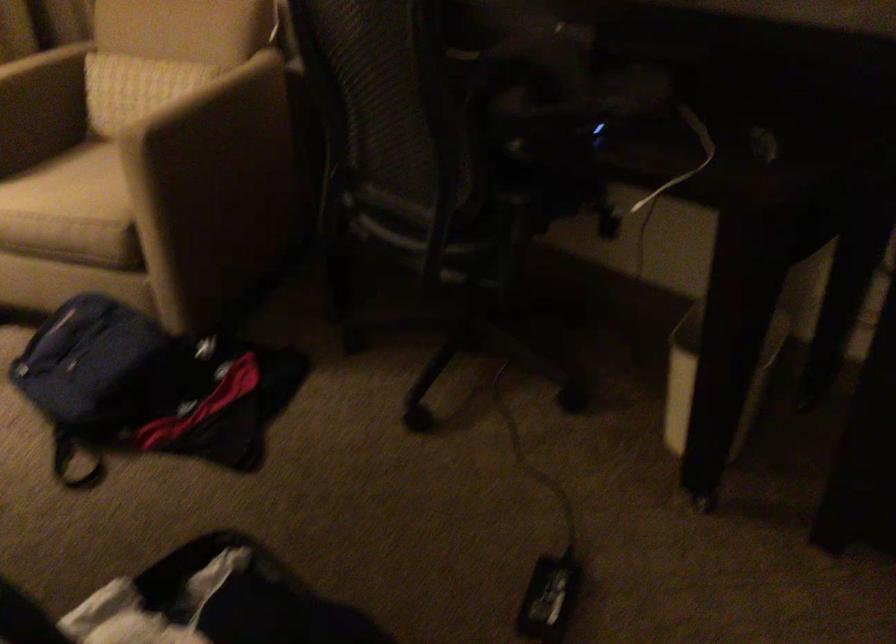
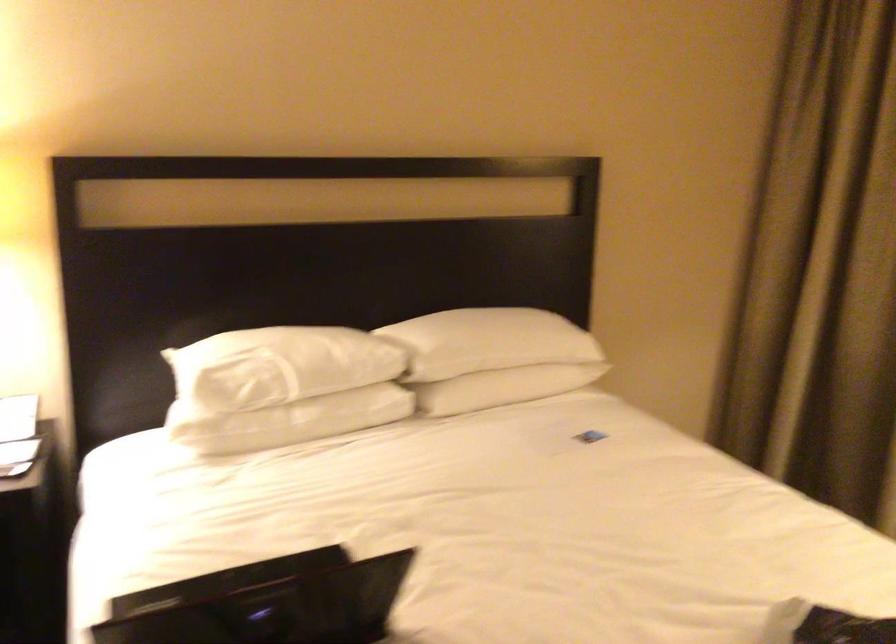
The images are taken continuously from a first-person perspective. In which direction is your viewpoint rotating?

The camera's rotation is toward left-down.